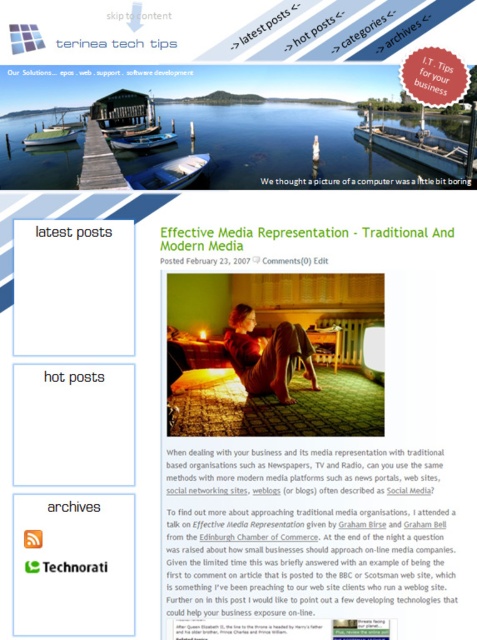
You are navigating a webpage and want to click on the point closer to you between point [82,164] and point [186,168]. Which point should you click?

Point [82,164] is further to the viewer than point [186,168], so you should click point [82,164].

You are standing on the wooden dock at center. There is a point marked at coordinates (99, 161). Is this point located on the wooden dock at center?

Yes, the point (99, 161) is on the wooden dock at center according to the description.

You are a customer looking to buy a boat for a small pond in your backyard. You see the blue plastic boat at center and the green plastic boat at upper left in the image. Which boat is positioned lower in the picture?

The blue plastic boat at center is positioned lower than the green plastic boat at upper left.